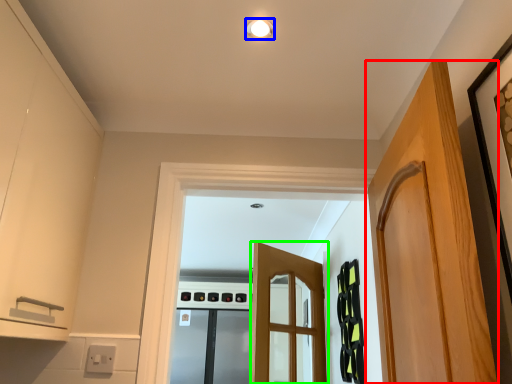
Question: Which object is the closest to the door (highlighted by a red box)? Choose among these: light fixture (highlighted by a blue box) or door (highlighted by a green box).

Choices:
 (A) light fixture
 (B) door

Answer: (A)